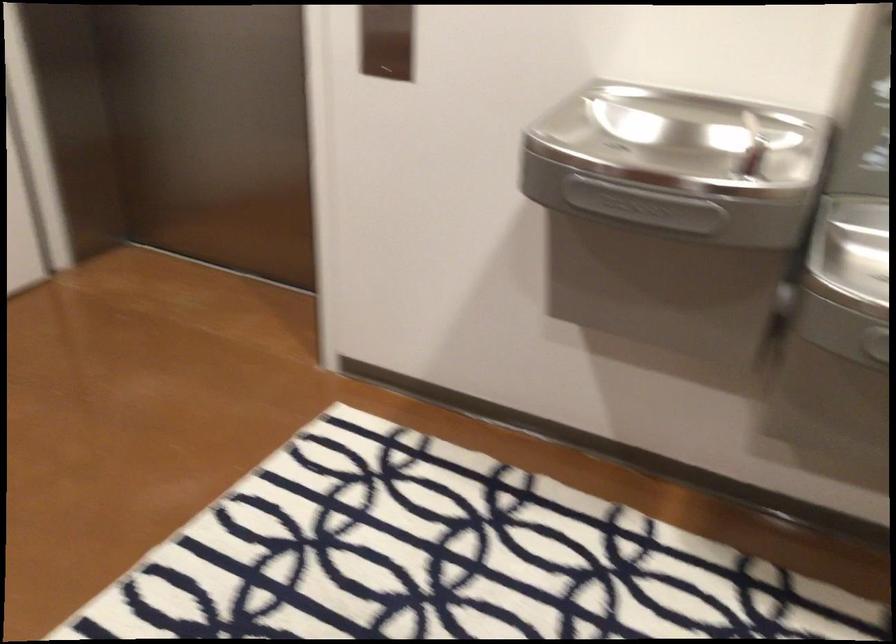
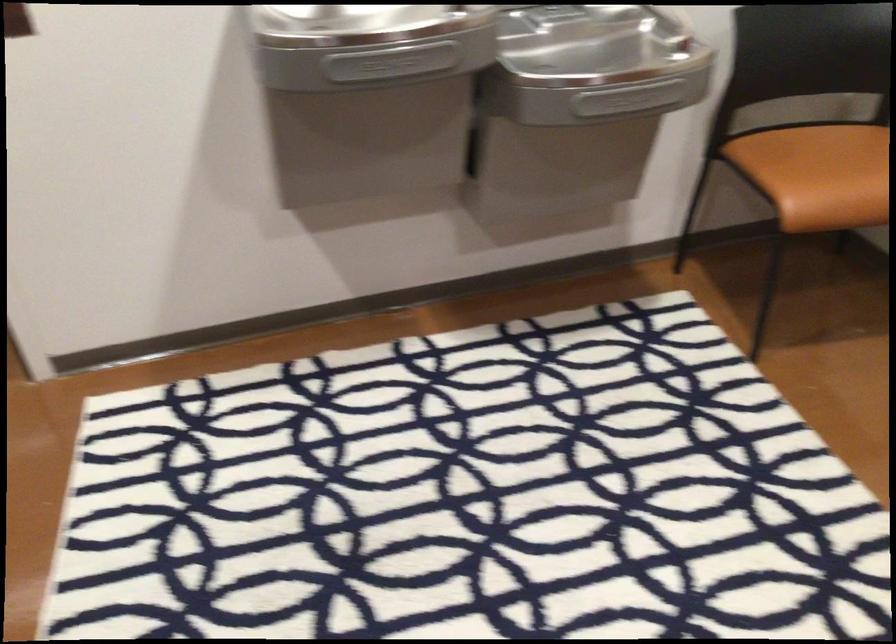
Question: The camera is either moving clockwise (left) or counter-clockwise (right) around the object. The first image is from the beginning of the video and the second image is from the end. Is the camera moving left or right when shooting the video?

Choices:
 (A) Left
 (B) Right

Answer: (A)